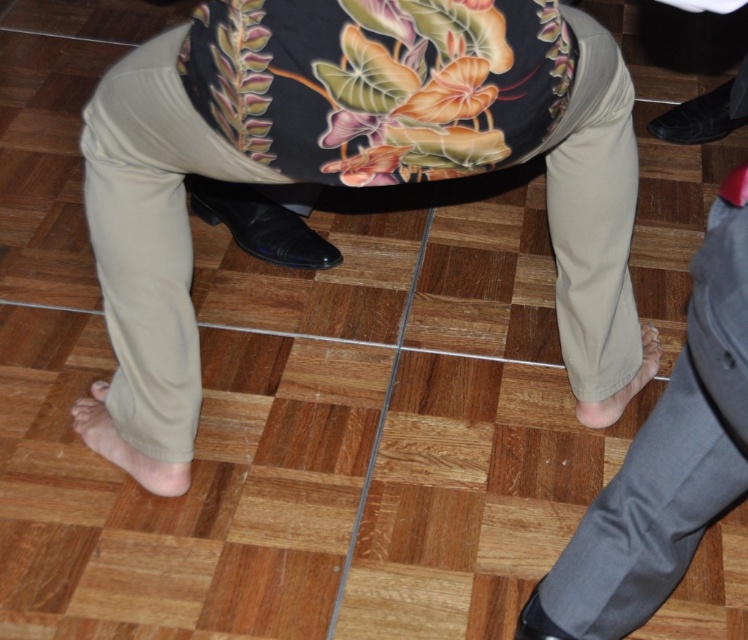
Is matte khaki pants at center positioned before tan fabric foot at lower right?

That is True.

Is point (398, 64) closer to camera compared to point (603, 401)?

Yes, point (398, 64) is in front of point (603, 401).

Locate an element on the screen. The image size is (748, 640). matte khaki pants at center is located at coordinates (352, 160).

In the scene shown: Does matte khaki pants at center have a lesser width compared to black leather shoe at lower left?

No.

Who is taller, matte khaki pants at center or black leather shoe at lower left?

With more height is matte khaki pants at center.

Between point (600, 170) and point (245, 227), which one is positioned behind?

Point (245, 227)

Find the location of `matte khaki pants at center`. matte khaki pants at center is located at coordinates (352, 160).

Does black leather shoe at lower left lie in front of tan fabric foot at lower right?

No, it is behind tan fabric foot at lower right.

Does black leather shoe at lower left appear under tan fabric foot at lower right?

No, black leather shoe at lower left is not below tan fabric foot at lower right.

Is point (301, 262) in front of point (657, 368)?

No, (301, 262) is further to viewer.

Find the location of a particular element. This screenshot has height=640, width=748. black leather shoe at lower left is located at coordinates (260, 225).